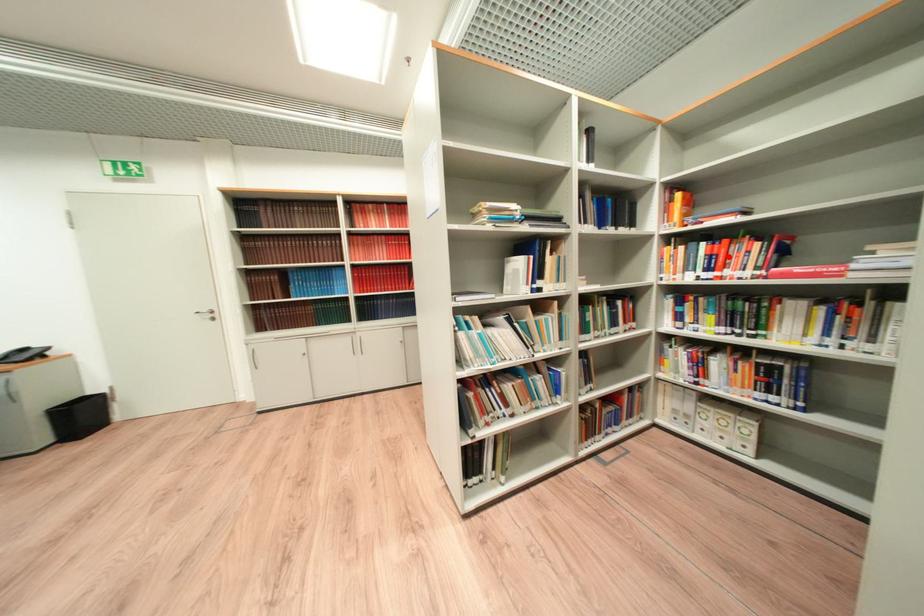
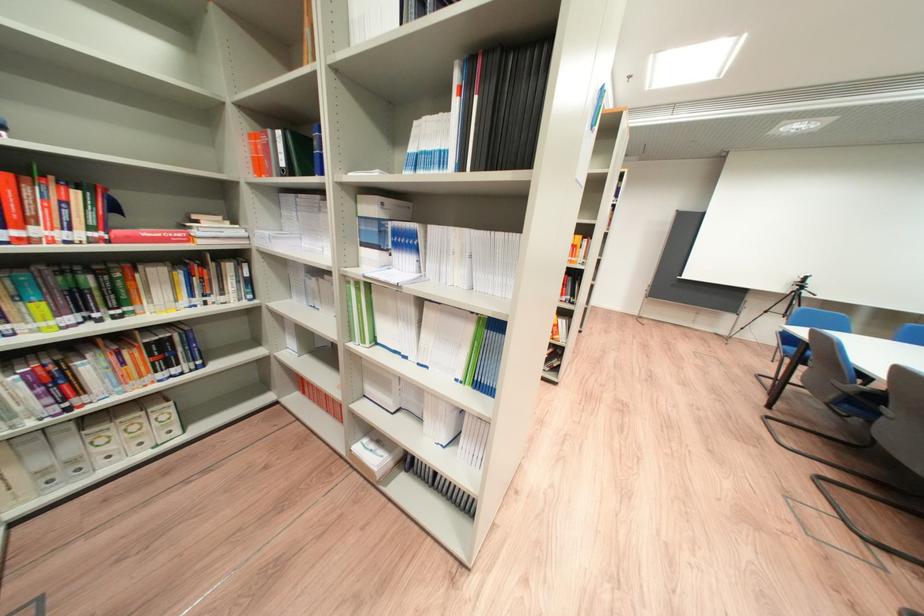
Question: A red point is marked in image1. In image2, is the corresponding 3D point closer to the camera or farther? Reply with the corresponding letter.

Choices:
 (A) The corresponding 3D point is closer.
 (B) The corresponding 3D point is farther.

Answer: (B)